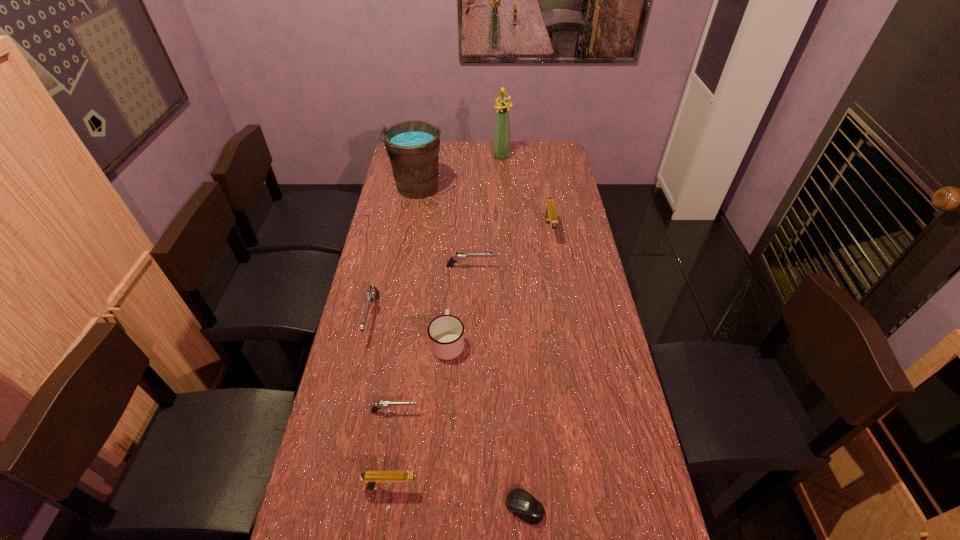
The height and width of the screenshot is (540, 960). Find the location of `object at the right edge`. object at the right edge is located at coordinates (550, 215).

The image size is (960, 540). In the image, there is a desktop. In order to click on vacant region at the far edge in this screenshot , I will do `click(521, 147)`.

Where is `free space at the left edge of the desktop`? free space at the left edge of the desktop is located at coordinates [376, 373].

In the image, there is a desktop. Identify the location of blank space at the right edge. This screenshot has width=960, height=540. (544, 179).

The image size is (960, 540). In order to click on free space between the nearest pistol and the fourth farthest pistol in this screenshot , I will do `click(393, 449)`.

This screenshot has height=540, width=960. In order to click on free space between the mug and the second silver pistol from right to left in this screenshot , I will do `click(421, 377)`.

At what (x,y) coordinates should I click in order to perform the action: click on empty space that is in between the eighth shortest object and the leftmost silver pistol. Please return your answer as a coordinate pair (x, y). The image size is (960, 540). Looking at the image, I should click on [395, 254].

At what (x,y) coordinates should I click in order to perform the action: click on free area in between the second nearest pistol and the green bouquet. Please return your answer as a coordinate pair (x, y). Looking at the image, I should click on (448, 284).

Find the location of a particular element. The width and height of the screenshot is (960, 540). vacant space in between the second shortest pistol and the eighth shortest object is located at coordinates (444, 228).

Locate an element on the screen. vacant space that is in between the nearer tan pistol and the nearest silver pistol is located at coordinates (393, 449).